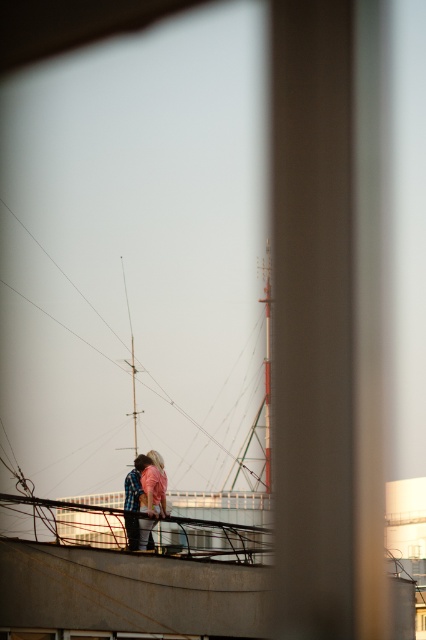
Question: Based on their relative distances, which object is nearer to the pink fabric at center?

Choices:
 (A) metallic mast at center
 (B) wooden mast at center

Answer: (B)

Question: Does pink fabric at center appear over wooden mast at center?

Choices:
 (A) no
 (B) yes

Answer: (A)

Question: Based on their relative distances, which object is nearer to the pink fabric at center?

Choices:
 (A) wooden mast at center
 (B) metallic mast at center

Answer: (A)

Question: Is pink fabric at center wider than wooden mast at center?

Choices:
 (A) no
 (B) yes

Answer: (A)

Question: Which of these objects is positioned closest to the metallic mast at center?

Choices:
 (A) pink fabric at center
 (B) wooden mast at center

Answer: (B)

Question: Does pink fabric at center have a larger size compared to metallic mast at center?

Choices:
 (A) yes
 (B) no

Answer: (B)